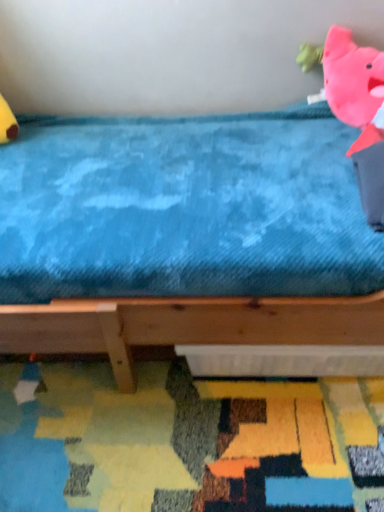
Question: In the image, is textured multicolored mat at lower center on the left side or the right side of pink plush toy at upper right?

Choices:
 (A) left
 (B) right

Answer: (A)

Question: Is textured multicolored mat at lower center spatially inside pink plush toy at upper right, or outside of it?

Choices:
 (A) outside
 (B) inside

Answer: (A)

Question: Estimate the real-world distances between objects in this image. Which object is closer to the blue plush bed at upper center?

Choices:
 (A) textured multicolored mat at lower center
 (B) pink plush toy at upper right

Answer: (A)

Question: Considering the real-world distances, which object is farthest from the textured multicolored mat at lower center?

Choices:
 (A) pink plush toy at upper right
 (B) blue plush bed at upper center

Answer: (A)